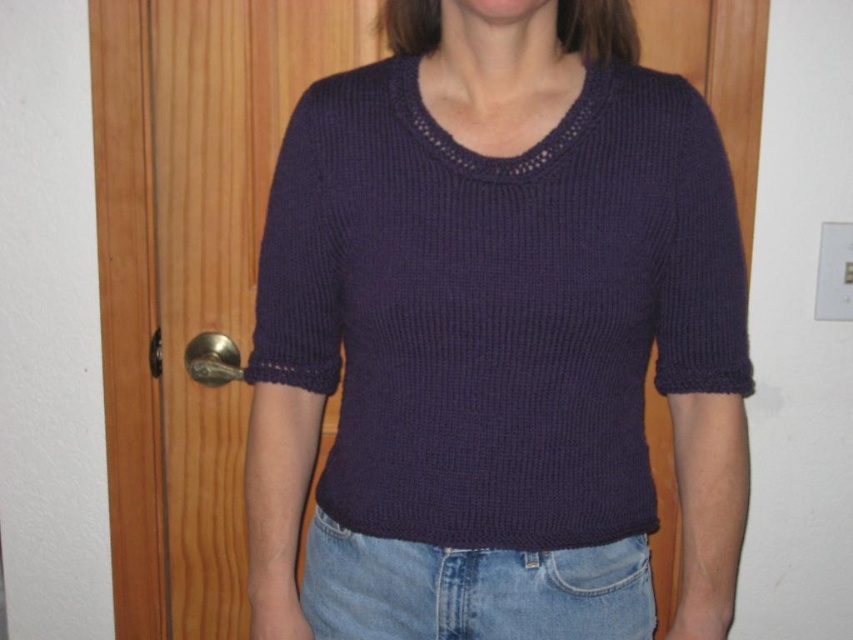
You are helping someone choose an outfit for a casual day. They want to know if the dark purple knit sweater at center will cover the denim at lower center when worn. Based on the image, can you confirm?

The dark purple knit sweater at center is taller than denim at lower center, so yes, the sweater will cover the denim when worn.

You are helping someone get dressed and need to put on a dark purple knit sweater at center and denim at lower center. Which item should you put on first according to the current arrangement?

The dark purple knit sweater at center should be put on first because it is in front of the denim at lower center, indicating it is already worn over the denim.